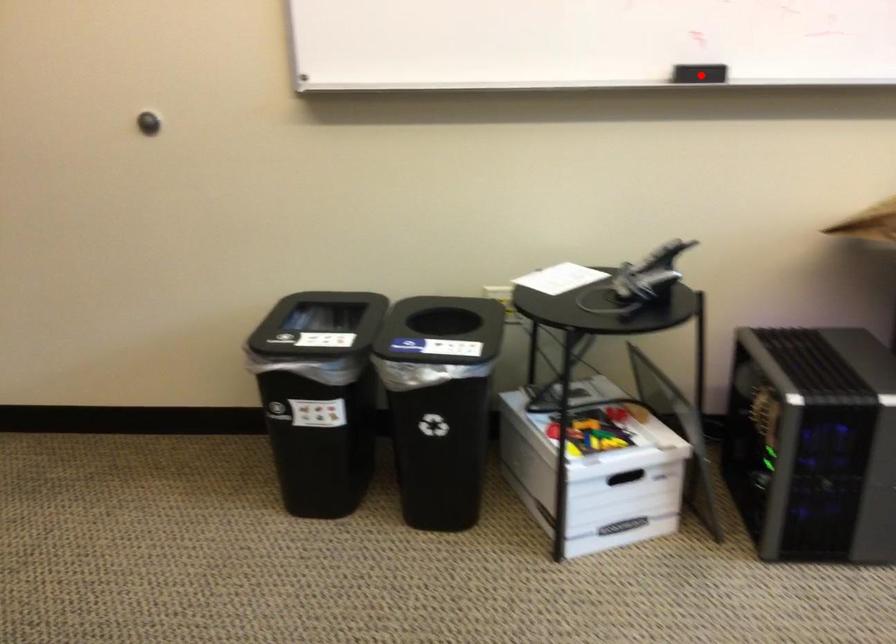
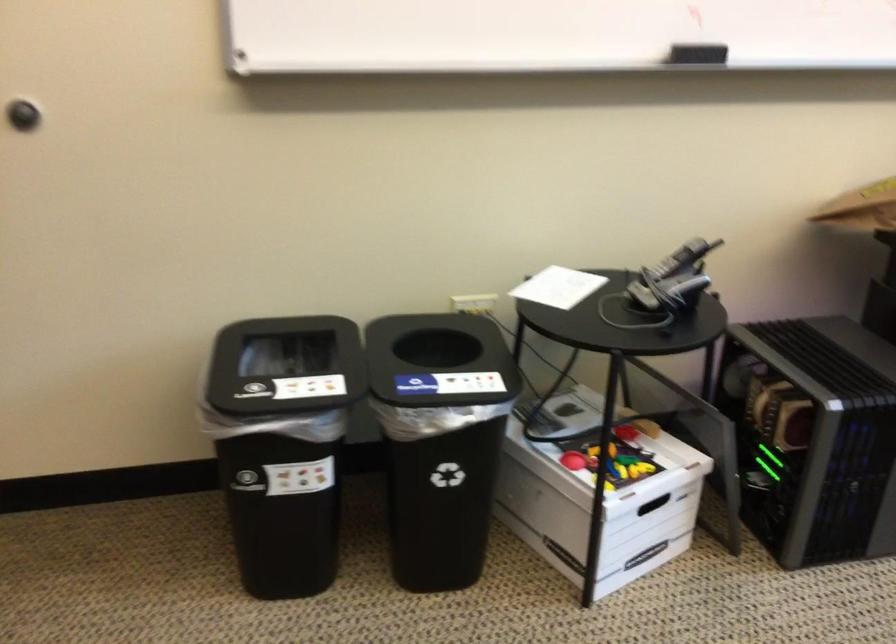
The point at the highlighted location is marked in the first image. Where is the corresponding point in the second image?

(696, 53)